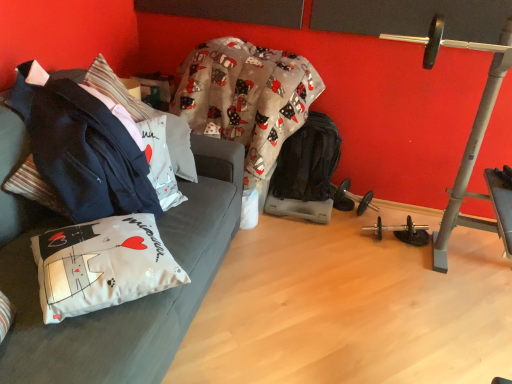
Question: Is white fabric pillow at center, which is the 2th pillow from bottom to top, spatially inside white fabric couch at left, or outside of it?

Choices:
 (A) outside
 (B) inside

Answer: (B)

Question: From the image's perspective, is white fabric pillow at center, positioned as the first pillow in back-to-front order, above or below white fabric couch at left?

Choices:
 (A) above
 (B) below

Answer: (A)

Question: Which object is the closest to the white fabric couch at left?

Choices:
 (A) patterned fabric blanket at center
 (B) white fabric pillow at lower left, marked as the second pillow in a back-to-front arrangement
 (C) black rubber dumbbell at lower center
 (D) white fabric pillow at center, which is the first pillow from top to bottom
 (E) dark blue fabric jacket at left

Answer: (B)

Question: Which is nearer to the white fabric pillow at center, which is the first pillow from top to bottom?

Choices:
 (A) white fabric couch at left
 (B) dark blue fabric jacket at left
 (C) white fabric pillow at lower left, the first pillow positioned from the front
 (D) black rubber dumbbell at lower center
 (E) patterned fabric blanket at center

Answer: (B)